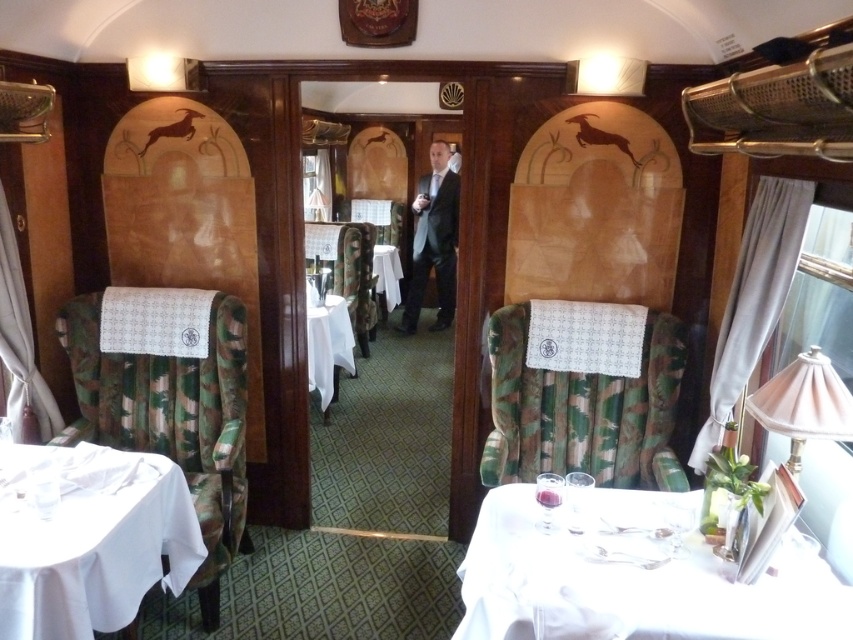
You are a passenger in the train dining car and want to place your small bag on the nearest available surface. The point where you are standing is at coordinate point (625, 589). Which object should you place your bag on?

The white cloth at lower right represented by point (625, 589) is the nearest available surface to place your bag.